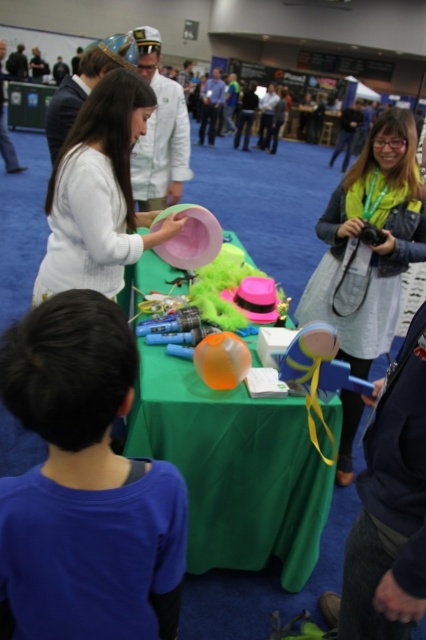
You are standing at the point marked as point (340,307) in the image. The event organizer has placed a prize box exactly 2 meters away from this point. Can you reach the prize box without moving from your current position?

The distance of point (340,307) from the viewer is 2.46 meters. Since the prize box is placed 2 meters away from this point, you are currently 0.46 meters farther away than needed. You would need to move closer by approximately 0.46 meters to reach the prize box without moving from your current position.

A young boy and a woman are at an event. The boy is at point (123,216). They are 1.90 meters apart. The woman is holding a pink hat. If the boy wants to ask her a question, can he do so without moving closer than 2 meters?

Yes, the boy can ask the woman a question without moving closer than 2 meters because they are already 1.90 meters apart, which is within the 2 meter distance.